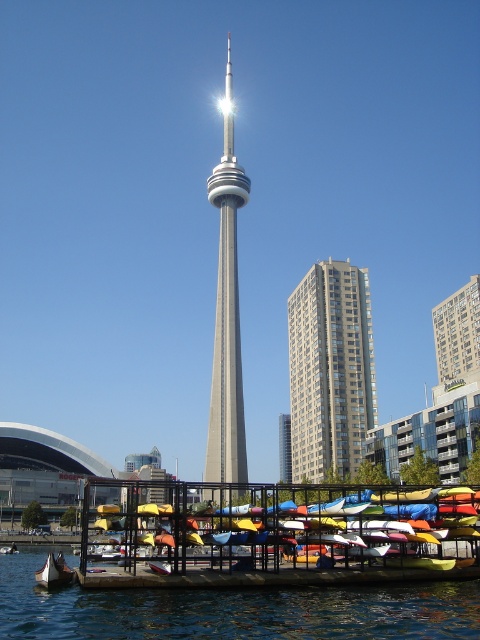
Who is more distant from viewer, (469,300) or (69,580)?

Positioned behind is point (469,300).

In order to click on gray concrete building at center in this screenshot , I will do `click(457, 332)`.

Locate an element on the screen. The height and width of the screenshot is (640, 480). gray concrete building at center is located at coordinates (457, 332).

Which is behind, point (211, 394) or point (70, 570)?

The point (211, 394) is more distant.

Is silver metallic cn tower at center closer to the viewer compared to wooden canoe at lower left?

No, silver metallic cn tower at center is further to the viewer.

This screenshot has height=640, width=480. What do you see at coordinates (227, 312) in the screenshot?
I see `silver metallic cn tower at center` at bounding box center [227, 312].

Identify the location of silver metallic cn tower at center. The width and height of the screenshot is (480, 640). (227, 312).

Which is below, transparent water at lower center or gray concrete building at center?

transparent water at lower center is lower down.

Between point (264, 596) and point (447, 372), which one is positioned in front?

Point (264, 596) is in front.

Between point (149, 600) and point (471, 314), which one is positioned in front?

Point (149, 600)

Identify the location of transparent water at lower center. (231, 611).